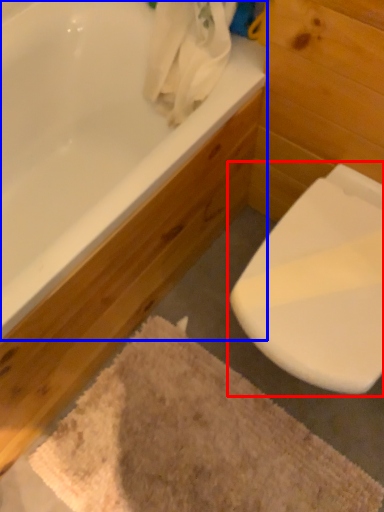
Question: Which point is closer to the camera, toilet (highlighted by a red box) or bathtub (highlighted by a blue box)?

Choices:
 (A) toilet
 (B) bathtub

Answer: (B)